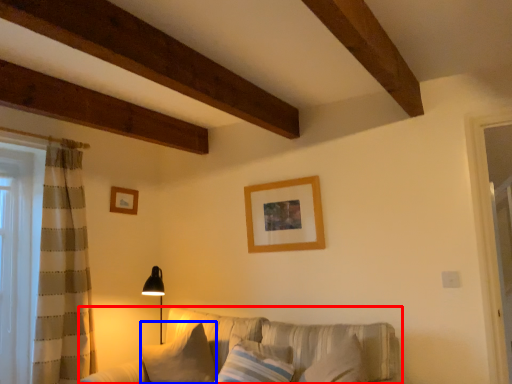
Question: Among these objects, which one is nearest to the camera, studio couch (highlighted by a red box) or pillow (highlighted by a blue box)?

Choices:
 (A) studio couch
 (B) pillow

Answer: (A)